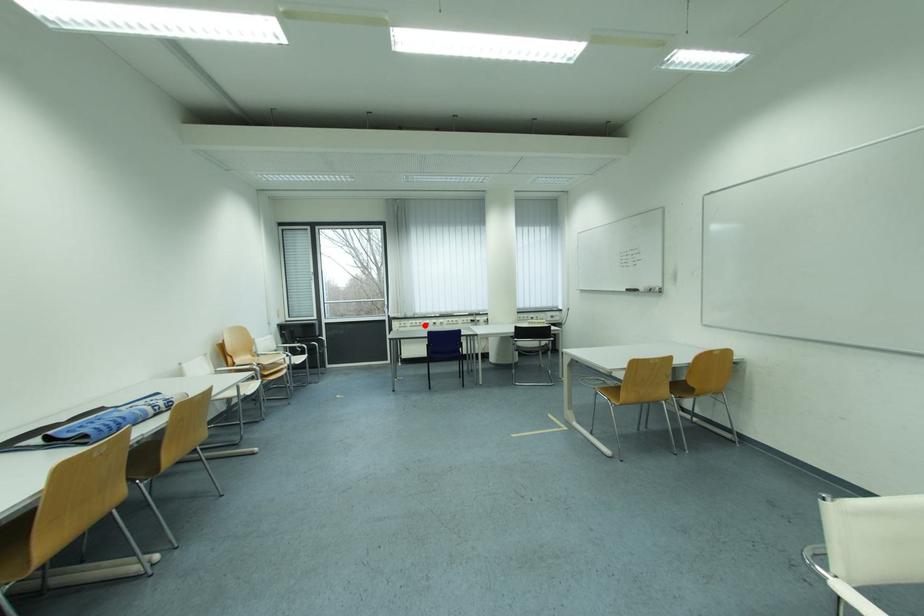
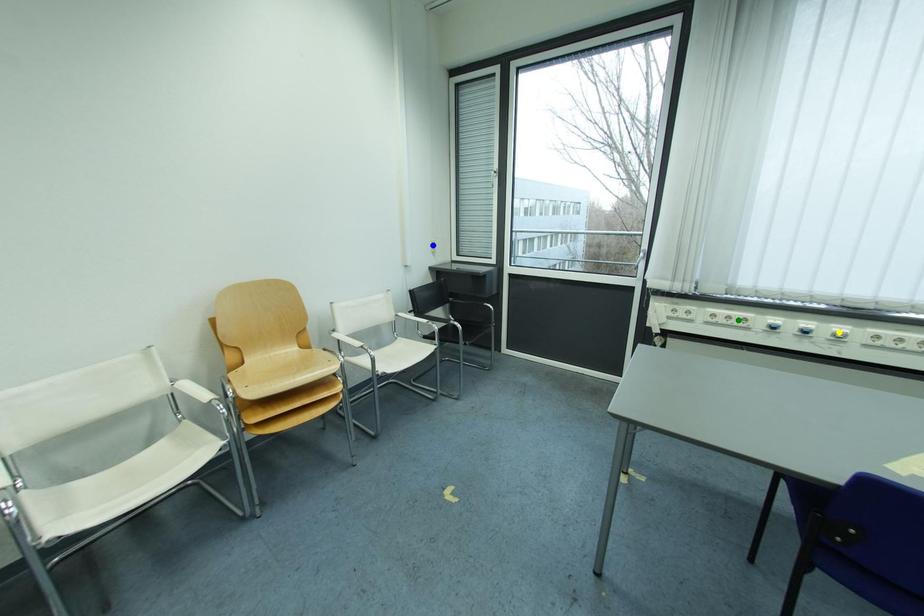
Question: I am providing you with two images of the same scene from different viewpoints. A red point is marked on the first image. You are given multiple points on the second image. In image 2, which mark is for the same physical point as the one in image 1?

Choices:
 (A) green point
 (B) blue point
 (C) yellow point

Answer: (A)